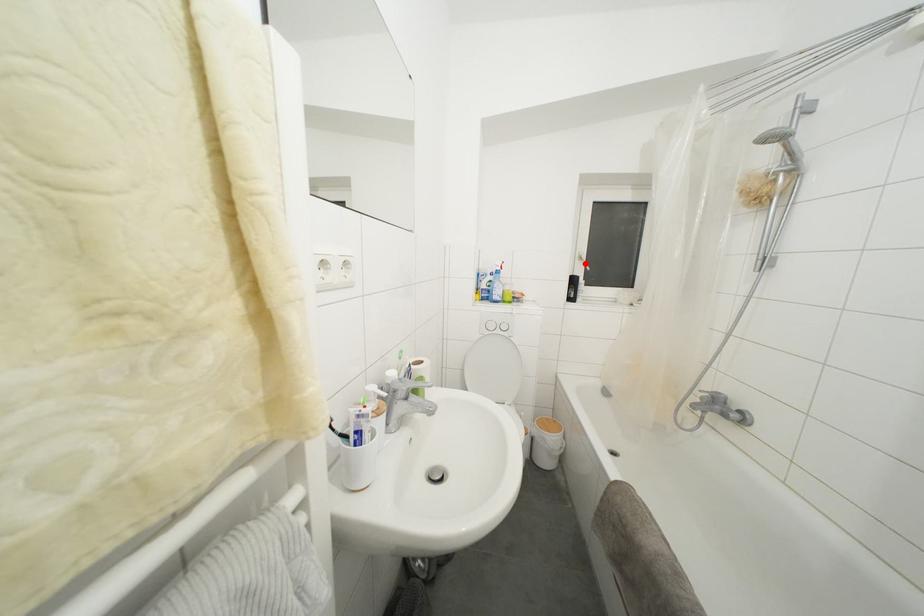
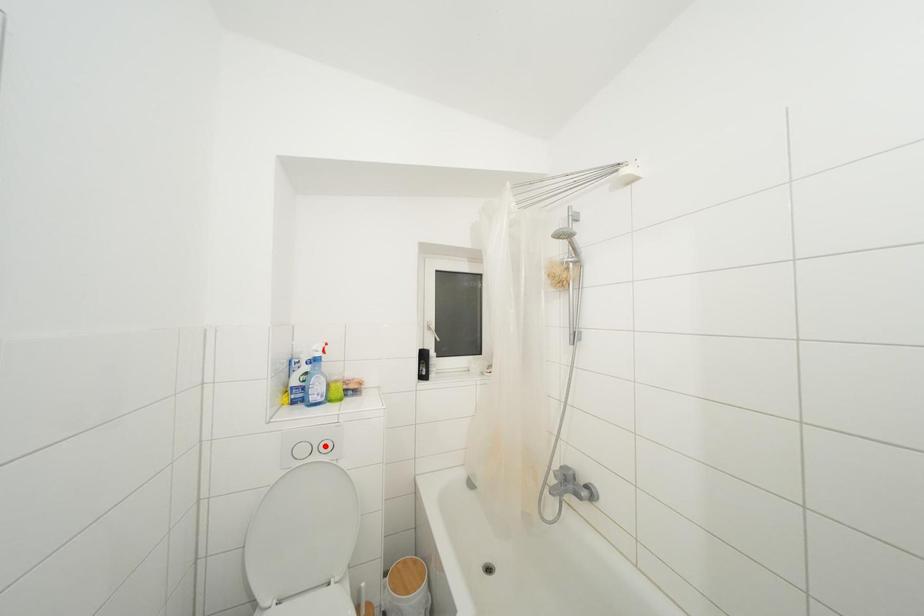
I am providing you with two images of the same scene from different viewpoints. A red point is marked on the first image and another point is marked on the second image. Are the points marked in image1 and image2 representing the same 3D position?

No